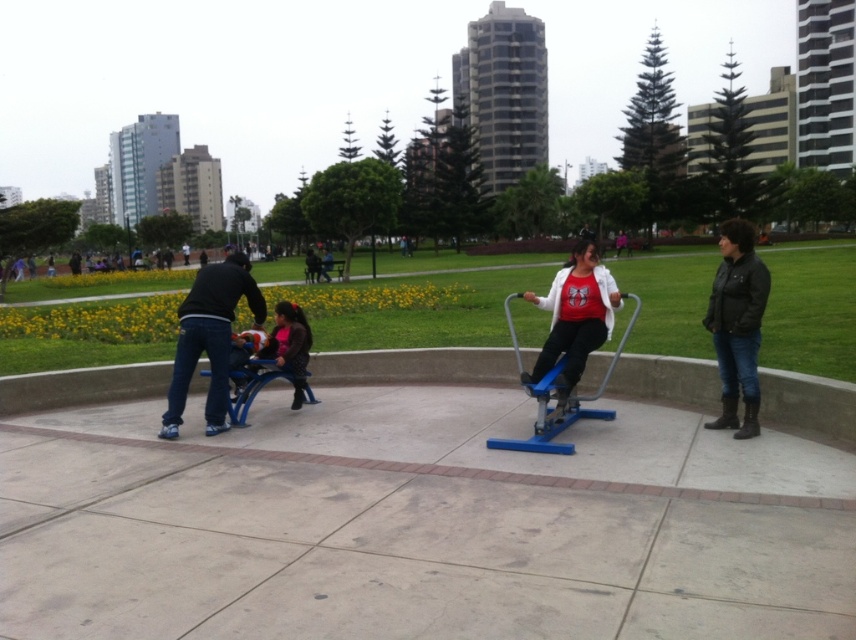
You are a park visitor who wants to walk from the exercise machine to the bench where the child is sitting. Which object will you step on first, the concrete at center or the matte white shirt at center?

The concrete at center is in front of the matte white shirt at center, so you will step on the concrete at center first.

You are a park visitor who wants to place a small potted plant between the concrete at center and the matte white shirt at center. Which object should the plant be placed closer to, based on their widths?

The concrete at center is thinner than matte white shirt at center, so the plant should be placed closer to the concrete at center to ensure proper spacing between the two objects.